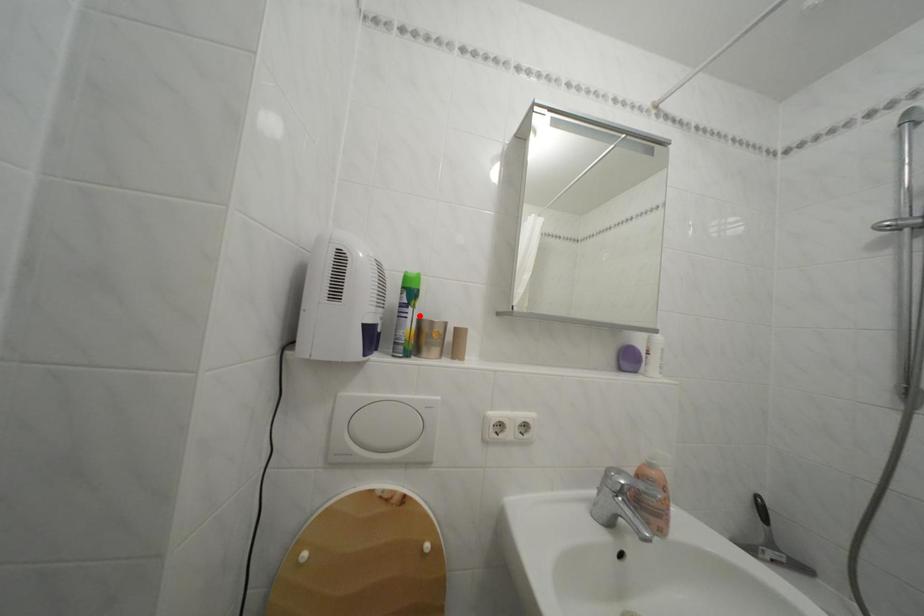
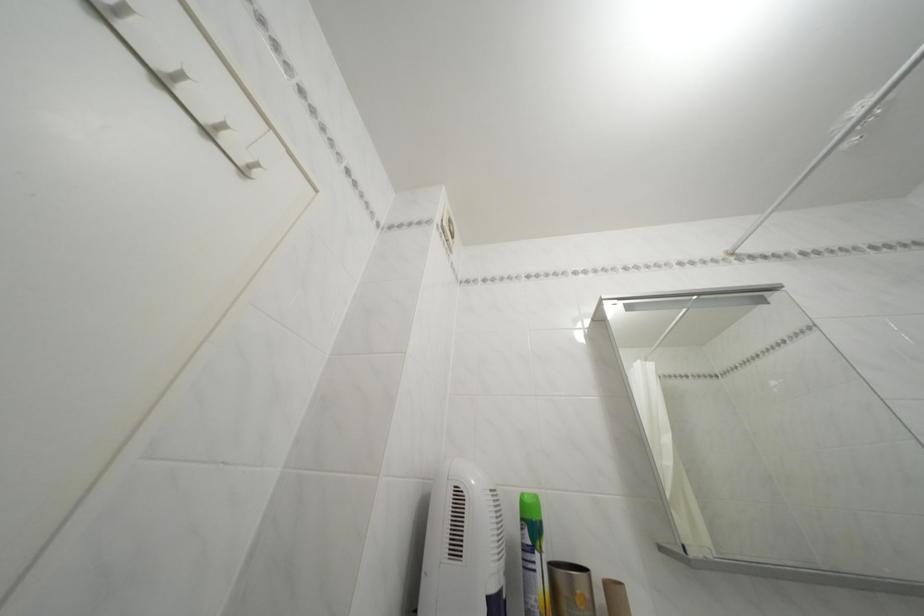
Where in the second image is the point corresponding to the highlighted location from the first image?

(545, 562)